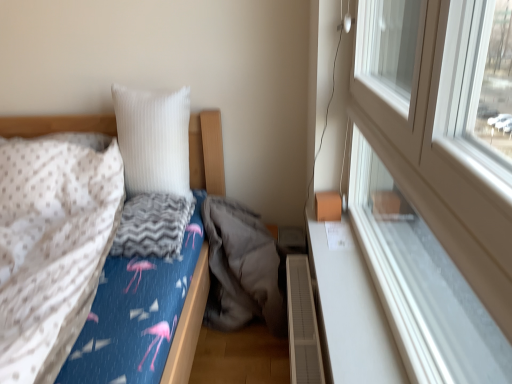
At what (x,y) coordinates should I click in order to perform the action: click on free spot above white smooth window sill at right (from a real-world perspective). Please return your answer as a coordinate pair (x, y). The image size is (512, 384). Looking at the image, I should click on (343, 269).